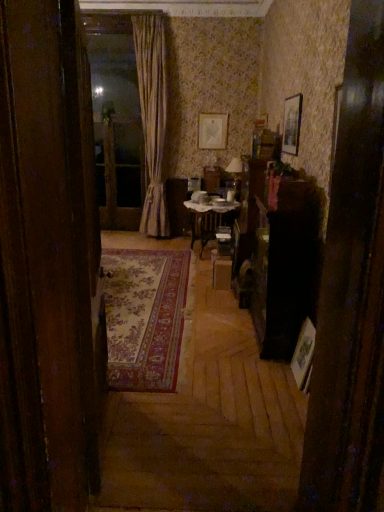
Where is `free area behind wooden door at left`? free area behind wooden door at left is located at coordinates (153, 373).